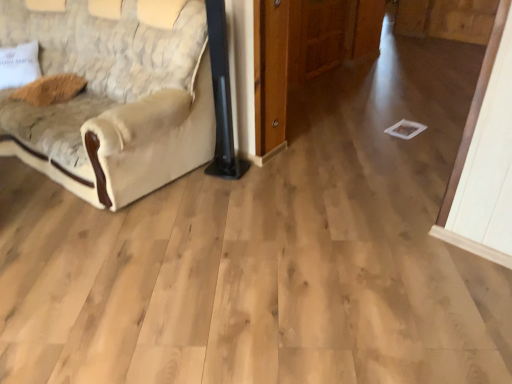
Question: Considering the relative sizes of beige fabric couch at left and brown fuzzy pillow at upper left, the first pillow viewed from the right, in the image provided, is beige fabric couch at left smaller than brown fuzzy pillow at upper left, the first pillow viewed from the right,?

Choices:
 (A) yes
 (B) no

Answer: (B)

Question: Considering the relative sizes of beige fabric couch at left and brown fuzzy pillow at upper left, acting as the 2th pillow starting from the left, in the image provided, is beige fabric couch at left wider than brown fuzzy pillow at upper left, acting as the 2th pillow starting from the left,?

Choices:
 (A) yes
 (B) no

Answer: (A)

Question: Is beige fabric couch at left at the left side of brown fuzzy pillow at upper left, acting as the 2th pillow starting from the left?

Choices:
 (A) no
 (B) yes

Answer: (A)

Question: Considering the relative sizes of beige fabric couch at left and brown fuzzy pillow at upper left, acting as the 2th pillow starting from the left, in the image provided, is beige fabric couch at left shorter than brown fuzzy pillow at upper left, acting as the 2th pillow starting from the left,?

Choices:
 (A) no
 (B) yes

Answer: (A)

Question: Can you confirm if beige fabric couch at left is thinner than brown fuzzy pillow at upper left, acting as the 2th pillow starting from the left?

Choices:
 (A) no
 (B) yes

Answer: (A)

Question: Is brown fuzzy pillow at upper left, acting as the 2th pillow starting from the left, spatially inside beige textured pillow at left, placed as the first pillow when sorted from left to right, or outside of it?

Choices:
 (A) inside
 (B) outside

Answer: (B)

Question: Is brown fuzzy pillow at upper left, acting as the 2th pillow starting from the left, wider or thinner than beige textured pillow at left, the second pillow in the right-to-left sequence?

Choices:
 (A) thin
 (B) wide

Answer: (B)

Question: Considering their positions, is brown fuzzy pillow at upper left, acting as the 2th pillow starting from the left, located in front of or behind beige textured pillow at left, the second pillow in the right-to-left sequence?

Choices:
 (A) front
 (B) behind

Answer: (A)

Question: From a real-world perspective, is brown fuzzy pillow at upper left, the first pillow viewed from the right, positioned above or below beige textured pillow at left, placed as the first pillow when sorted from left to right?

Choices:
 (A) above
 (B) below

Answer: (B)

Question: Is beige textured pillow at left, placed as the first pillow when sorted from left to right, taller or shorter than brown fuzzy pillow at upper left, the first pillow viewed from the right?

Choices:
 (A) short
 (B) tall

Answer: (B)

Question: From the image's perspective, is beige textured pillow at left, placed as the first pillow when sorted from left to right, above or below brown fuzzy pillow at upper left, the first pillow viewed from the right?

Choices:
 (A) below
 (B) above

Answer: (B)

Question: Would you say beige textured pillow at left, the second pillow in the right-to-left sequence, is to the left or to the right of brown fuzzy pillow at upper left, the first pillow viewed from the right, in the picture?

Choices:
 (A) left
 (B) right

Answer: (A)

Question: Based on their sizes in the image, would you say beige textured pillow at left, placed as the first pillow when sorted from left to right, is bigger or smaller than brown fuzzy pillow at upper left, the first pillow viewed from the right?

Choices:
 (A) big
 (B) small

Answer: (A)

Question: From the image's perspective, is beige fabric couch at left positioned above or below beige textured pillow at left, the second pillow in the right-to-left sequence?

Choices:
 (A) below
 (B) above

Answer: (A)

Question: From a real-world perspective, is beige fabric couch at left positioned above or below beige textured pillow at left, placed as the first pillow when sorted from left to right?

Choices:
 (A) below
 (B) above

Answer: (B)